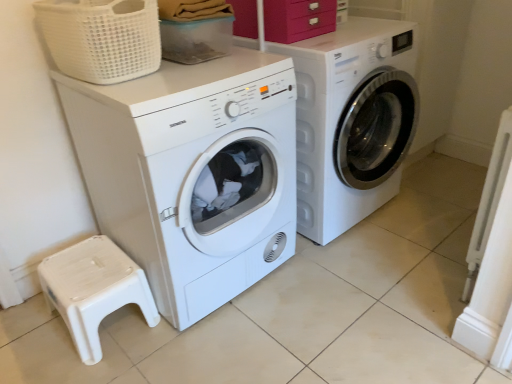
Find the location of a particular element. The width and height of the screenshot is (512, 384). free space above white plastic step stool at lower left (from a real-world perspective) is located at coordinates (85, 271).